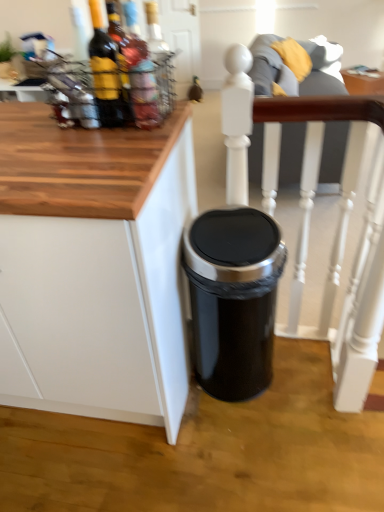
This screenshot has width=384, height=512. I want to click on vacant space to the right of black metallic trash can at center, so click(302, 380).